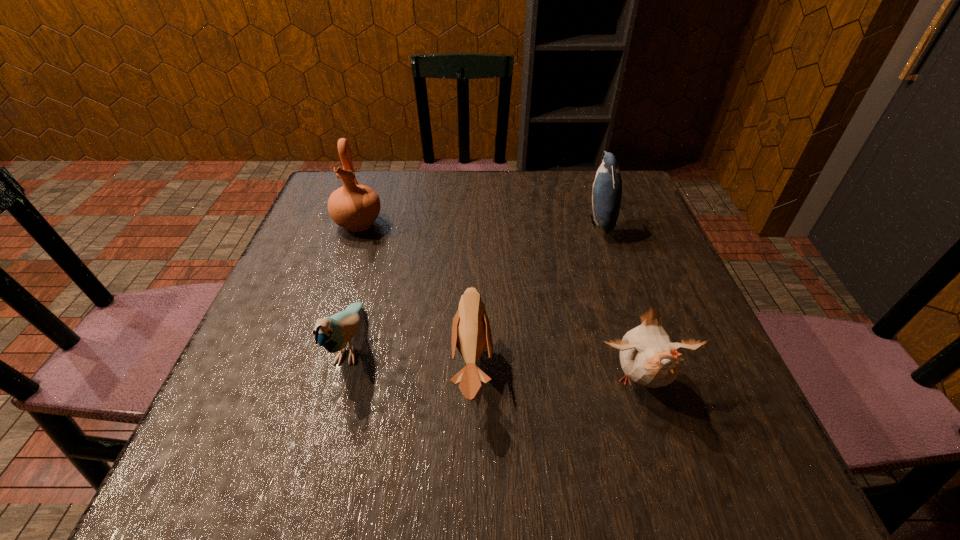
The height and width of the screenshot is (540, 960). Find the location of `pottery`. pottery is located at coordinates (355, 207).

I want to click on the farthest bird, so click(x=607, y=188).

Image resolution: width=960 pixels, height=540 pixels. Identify the location of the leftmost bird. (333, 333).

The width and height of the screenshot is (960, 540). Identify the location of the third object from left to right. (471, 334).

Identify the location of the shortest object. This screenshot has height=540, width=960. (471, 334).

Locate an element on the screen. The image size is (960, 540). vacant space located 0.280m on the spout of the pottery is located at coordinates (322, 330).

Find the location of `vacant space located 0.400m at the tip of the farthest bird's beak`. vacant space located 0.400m at the tip of the farthest bird's beak is located at coordinates [x=422, y=222].

You are a GUI agent. You are given a task and a screenshot of the screen. Output one action in this format:
    pyautogui.click(x=<x>, y=<y>)
    Task: Click on the vacant area located at the tip of the farthest bird's beak
    
    Given the screenshot: What is the action you would take?
    pyautogui.click(x=464, y=222)

Image resolution: width=960 pixels, height=540 pixels. What are the coordinates of `free space located 0.090m at the tip of the farthest bird's beak` in the screenshot? It's located at 549,222.

Where is `vacant position located 0.120m at the face of the leftmost bird`? This screenshot has height=540, width=960. vacant position located 0.120m at the face of the leftmost bird is located at coordinates (317, 468).